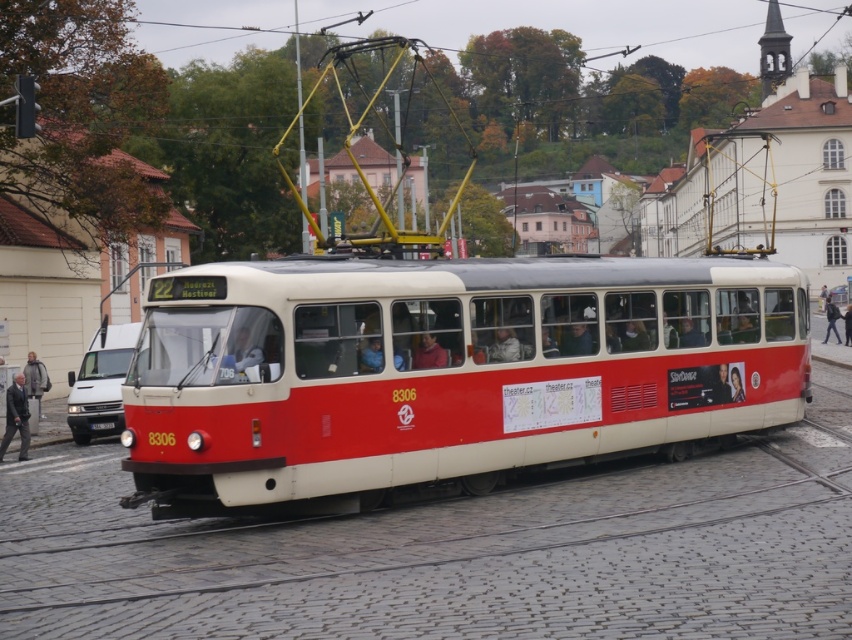
You are a passenger on the tram and want to check your phone. You have a matte plastic face at center and dark blue jeans at center in your view. Which object is closer to you?

The matte plastic face at center is positioned under dark blue jeans at center, so the matte plastic face at center is closer to you.

You are a passenger on the tram and notice two jackets hanging on hooks near the door. The jackets are the matte black jacket at center and the matte red jacket at center. Which jacket is bigger?

The matte black jacket at center is larger in size than the matte red jacket at center, so the matte black jacket at center is bigger.